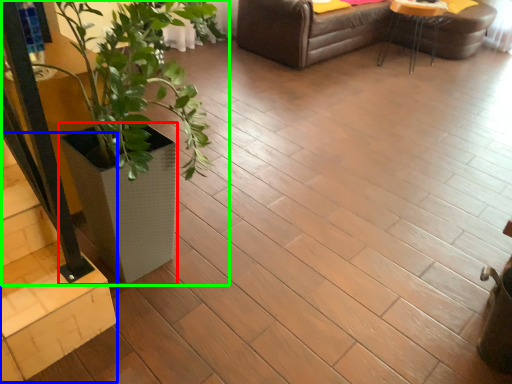
Question: Estimate the real-world distances between objects in this image. Which object is farther from flowerpot (highlighted by a red box), stairwell (highlighted by a blue box) or houseplant (highlighted by a green box)?

Choices:
 (A) stairwell
 (B) houseplant

Answer: (A)